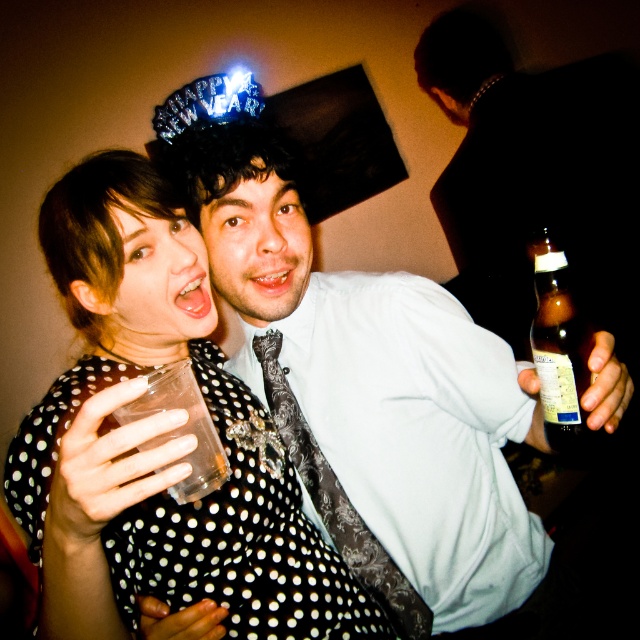
You are standing at the entrance of the room and want to locate the person wearing the matte black shirt at center. According to the coordinates provided, where should you look to find them?

The person wearing the matte black shirt at center is located at coordinates point (362, 380).

You are a photographer at a party and want to capture both the matte black shirt at center and the black dotted fabric dress at center in a single photo. Since you can only focus on one subject at a time, which one should you choose to ensure the other is still in the background?

You should focus on the matte black shirt at center because it is in front of the black dotted fabric dress at center, so the dress will naturally appear in the background if you focus on the shirt.

You are a photographer at the party and want to capture both the matte black shirt at center and the brown glass bottle at right in a single frame. Given that your camera has a fixed focal length, which object should you focus on to ensure both are in focus?

To ensure both the matte black shirt at center and the brown glass bottle at right are in focus, focus on the matte black shirt at center since it is larger and closer to the camera than the brown glass bottle at right.